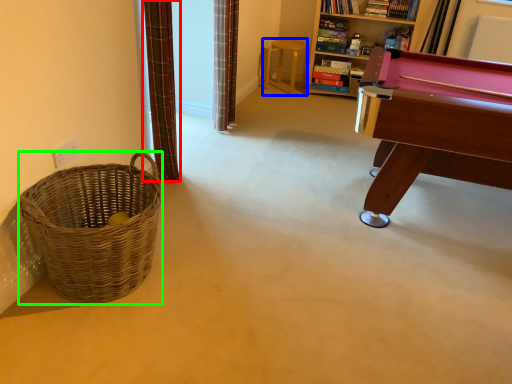
Question: Considering the real-world distances, which object is farthest from curtain (highlighted by a red box)? stool (highlighted by a blue box) or basket (highlighted by a green box)?

Choices:
 (A) stool
 (B) basket

Answer: (A)